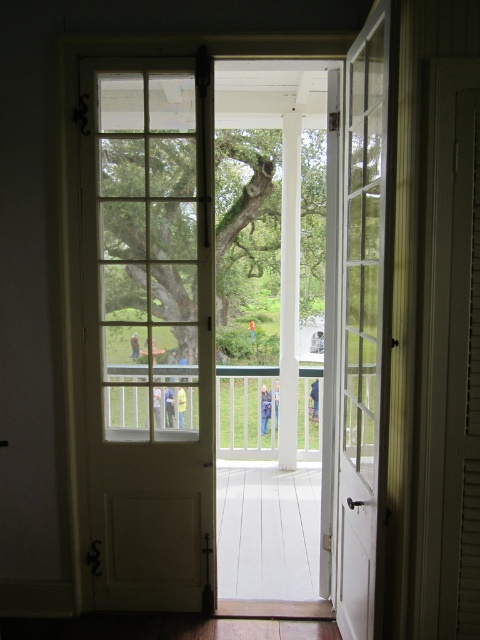
You are standing in the room and want to exit through the doors. Which door should you open first, the white wood door at center or the white glass door at center?

You should open the white wood door at center first because the white glass door at center is behind it.

You are standing in the room and want to exit through the door. Which door is on the left side when facing the doors? Please choose between the white wood door at center and the white glass door at center.

The white wood door at center is to the left of the white glass door at center, so the white wood door at center is on the left side when facing the doors.

You are a delivery person holding a large package that requires passing through the doors. The package is 27 inches wide. Can you fit through the space between the white wood door at center and the white glass door at center?

The white wood door at center is 26.87 inches away from the white glass door at center, so the package cannot fit through the space as it is slightly narrower than the package width.